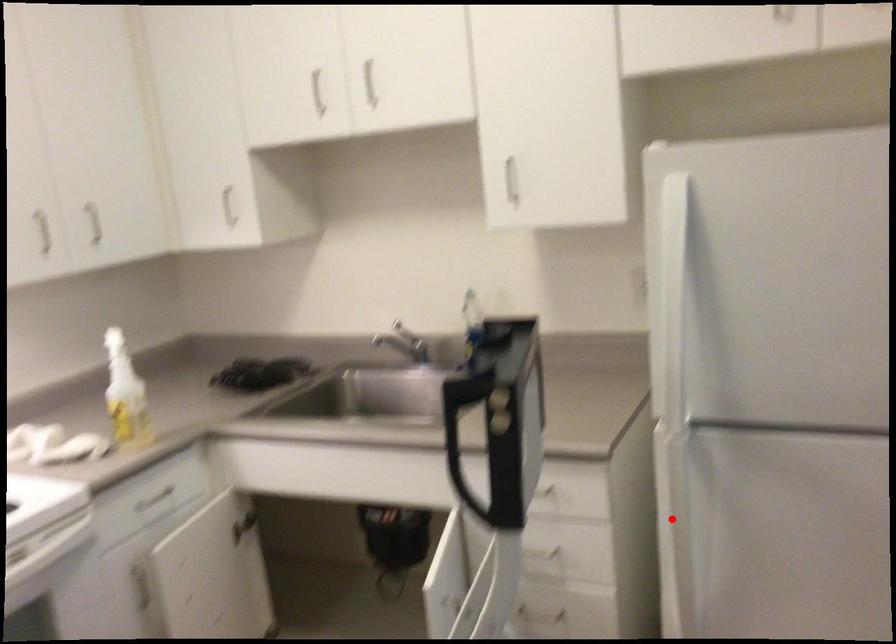
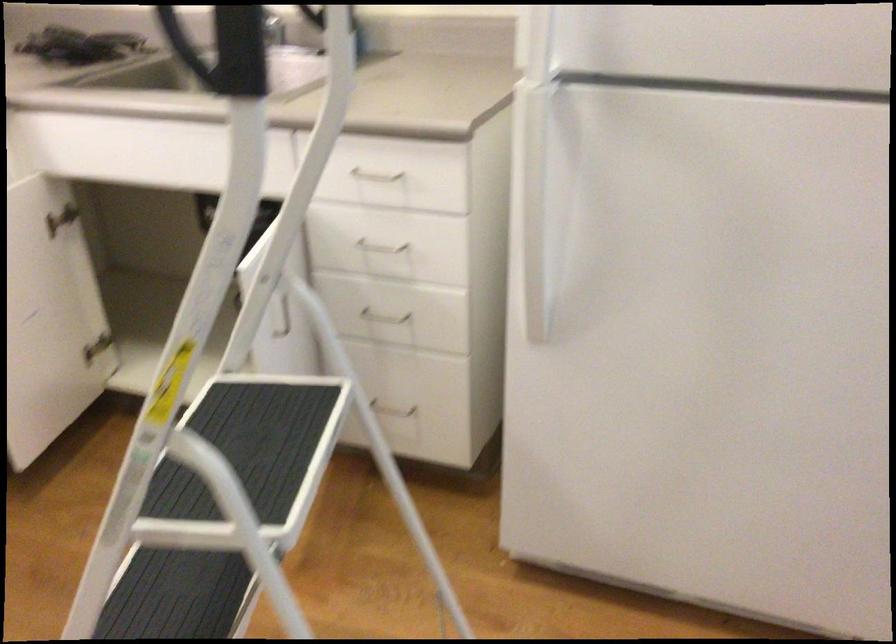
Question: I am providing you with two images of the same scene from different viewpoints. Given a red point in image1, look at the same physical point in image2. Is it:

Choices:
 (A) Closer to the viewpoint
 (B) Farther from the viewpoint

Answer: (A)